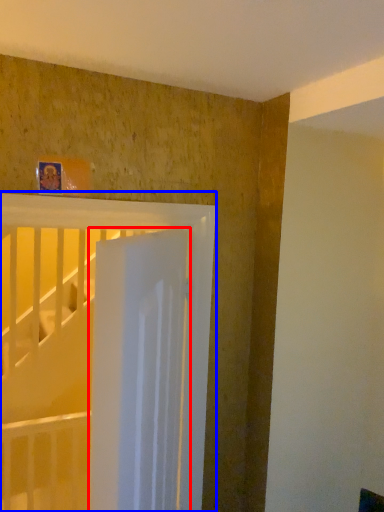
Question: Which point is further to the camera, door (highlighted by a red box) or bed (highlighted by a blue box)?

Choices:
 (A) door
 (B) bed

Answer: (B)